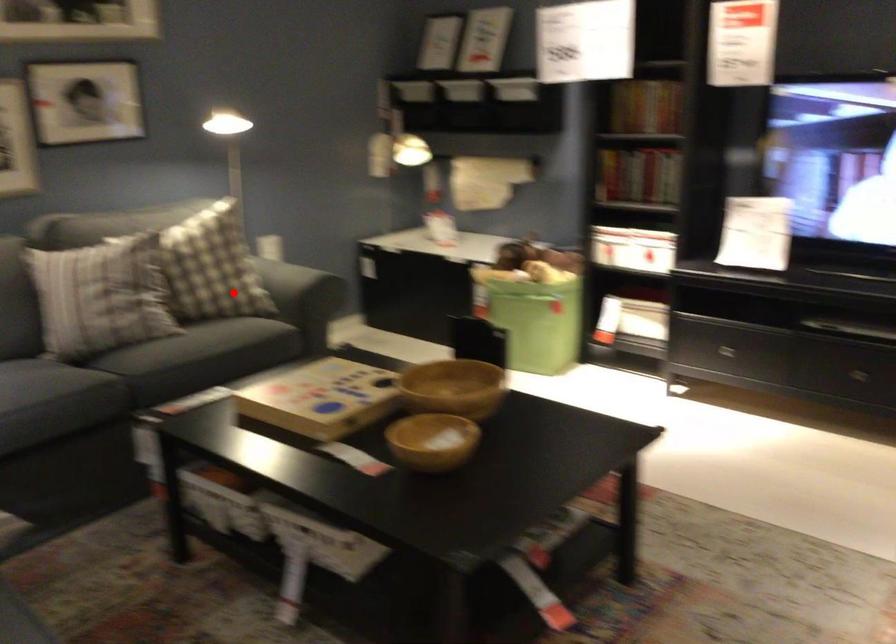
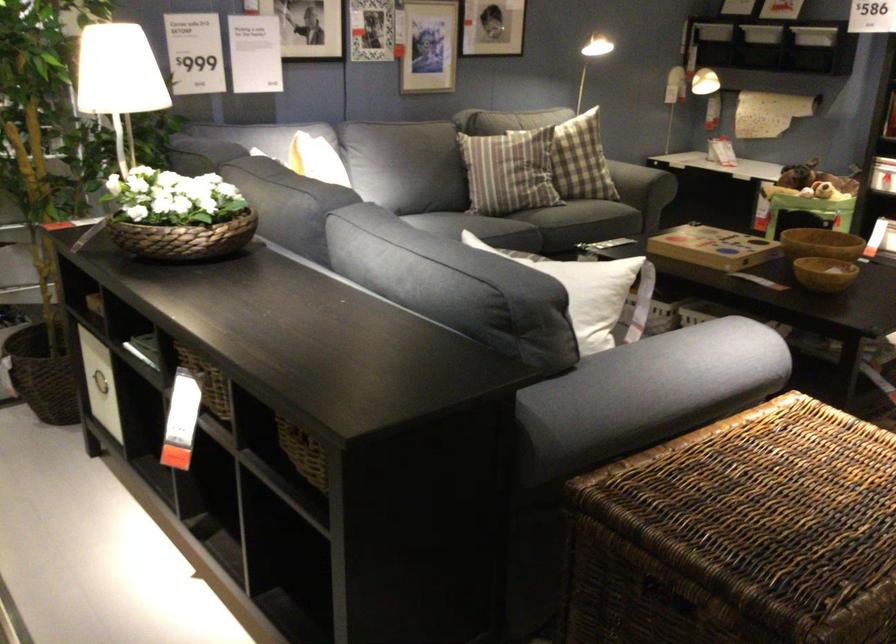
In the second image, find the point that corresponds to the highlighted location in the first image.

(633, 180)